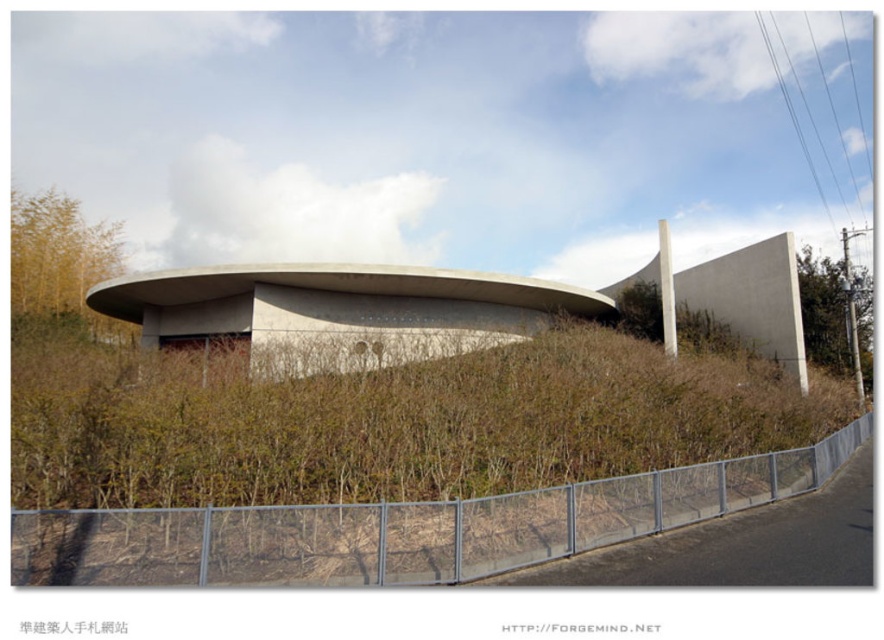
You are standing at the edge of a forest and see the brown dry grass at center and the concrete building at center. Which object is closer to you?

The brown dry grass at center is closer to you since it is only 23.73 feet away from the concrete building at center, which is further away.

You are a landscape architect evaluating the space between the brown dry grass at center and the concrete building at center. Which object occupies a larger area in the scene?

The concrete building at center is larger than the brown dry grass at center, so the concrete building at center occupies a larger area in the scene.

You are standing at the entrance of the modern building and see two points marked on the ground. The first point is labeled as point (51, 454) and the second point is labeled as point (162, 332). Which point is closer to you?

Point (51, 454) is in front of point (162, 332), so it is closer to you.